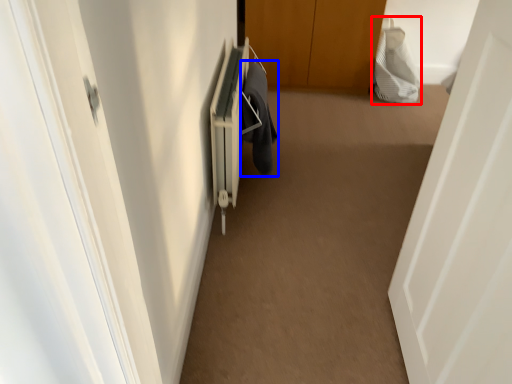
Question: Which object is closer to the camera taking this photo, material (highlighted by a red box) or laundry (highlighted by a blue box)?

Choices:
 (A) material
 (B) laundry

Answer: (B)